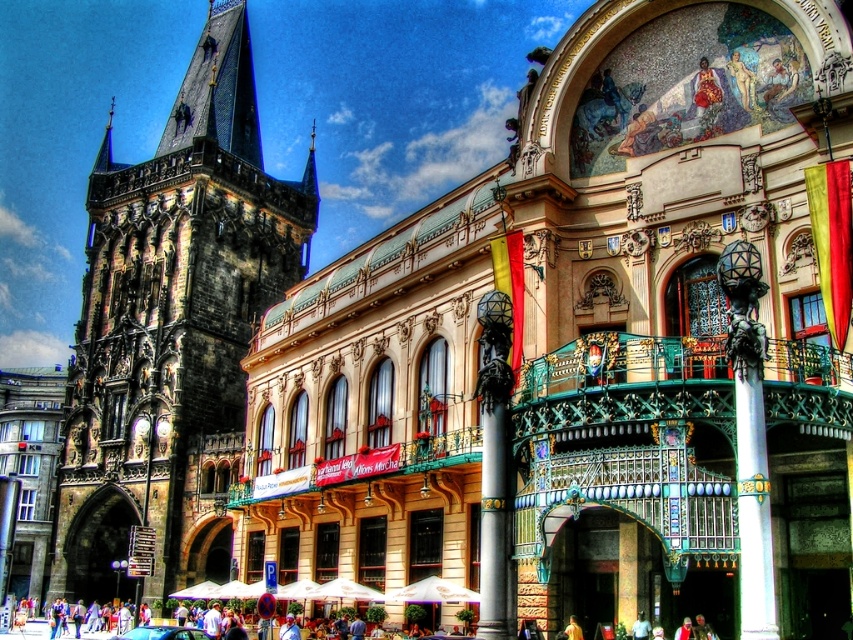
Question: Does dark stone tower at left come in front of metallic blue car at center?

Choices:
 (A) yes
 (B) no

Answer: (B)

Question: From the image, what is the correct spatial relationship of dark stone tower at left in relation to metallic blue car at center?

Choices:
 (A) above
 (B) below

Answer: (A)

Question: Which of the following is the closest to the observer?

Choices:
 (A) dark stone tower at left
 (B) metallic blue car at center

Answer: (B)

Question: Which point is farther to the camera?

Choices:
 (A) (149, 372)
 (B) (138, 637)

Answer: (A)

Question: Does dark stone tower at left have a smaller size compared to metallic blue car at center?

Choices:
 (A) yes
 (B) no

Answer: (B)